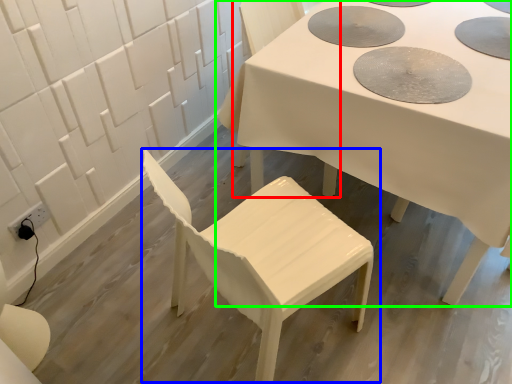
Question: Which is farther away from chair (highlighted by a red box)? chair (highlighted by a blue box) or table (highlighted by a green box)?

Choices:
 (A) chair
 (B) table

Answer: (A)